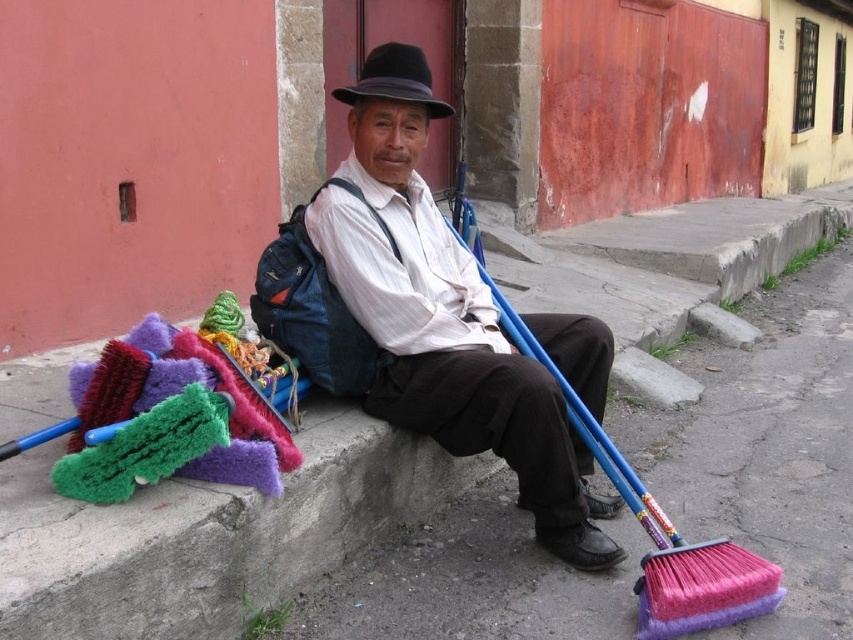
Is pink bristle broom at lower right to the right of black felt fedora at center from the viewer's perspective?

Yes, pink bristle broom at lower right is to the right of black felt fedora at center.

Identify the location of pink bristle broom at lower right. The width and height of the screenshot is (853, 640). (656, 524).

The height and width of the screenshot is (640, 853). I want to click on pink bristle broom at lower right, so click(656, 524).

Is matte white shirt at center wider than pink bristle broom at lower right?

Indeed, matte white shirt at center has a greater width compared to pink bristle broom at lower right.

Between matte white shirt at center and pink bristle broom at lower right, which one is positioned higher?

matte white shirt at center is above.

Where is `matte white shirt at center`? matte white shirt at center is located at coordinates (445, 314).

Can you confirm if matte white shirt at center is shorter than black felt fedora at center?

No.

Is matte white shirt at center behind black felt fedora at center?

No.

Which is in front, point (567, 317) or point (361, 84)?

Positioned in front is point (361, 84).

Where is `matte white shirt at center`? The width and height of the screenshot is (853, 640). matte white shirt at center is located at coordinates (445, 314).